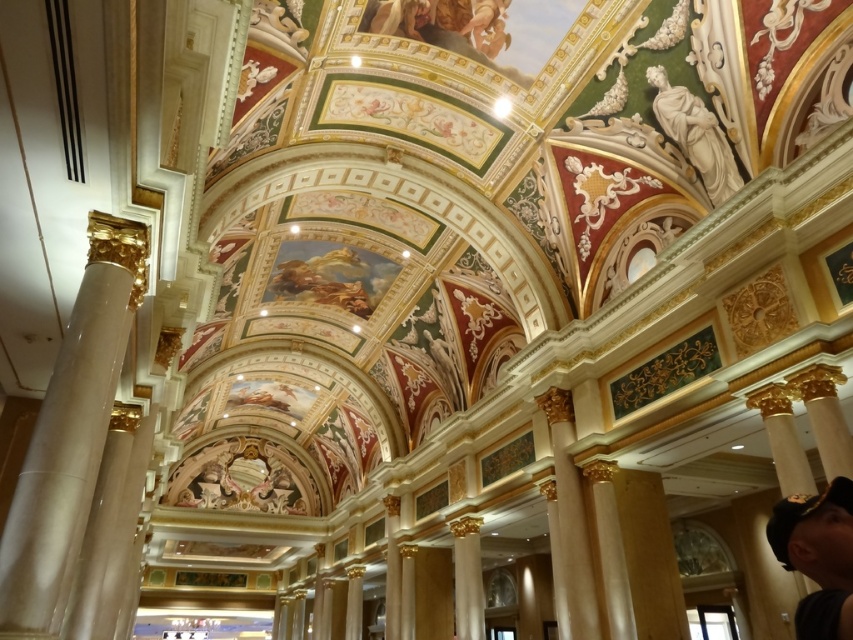
Question: Does black fabric cap at lower right have a smaller size compared to white marble statue at upper right?

Choices:
 (A) no
 (B) yes

Answer: (B)

Question: Which of the following is the farthest from the observer?

Choices:
 (A) coord(459,627)
 (B) coord(814,625)

Answer: (A)

Question: Which point appears farthest from the camera in this image?

Choices:
 (A) (828, 602)
 (B) (122, 218)
 (C) (461, 620)
 (D) (692, 106)

Answer: (C)

Question: Can you confirm if white marble statue at upper right is positioned to the left of gold polished pillar at center?

Choices:
 (A) no
 (B) yes

Answer: (A)

Question: Which is farther from the white marble statue at upper right?

Choices:
 (A) black fabric cap at lower right
 (B) white marble column at left

Answer: (B)

Question: Does white marble column at left lie behind white marble statue at upper right?

Choices:
 (A) no
 (B) yes

Answer: (A)